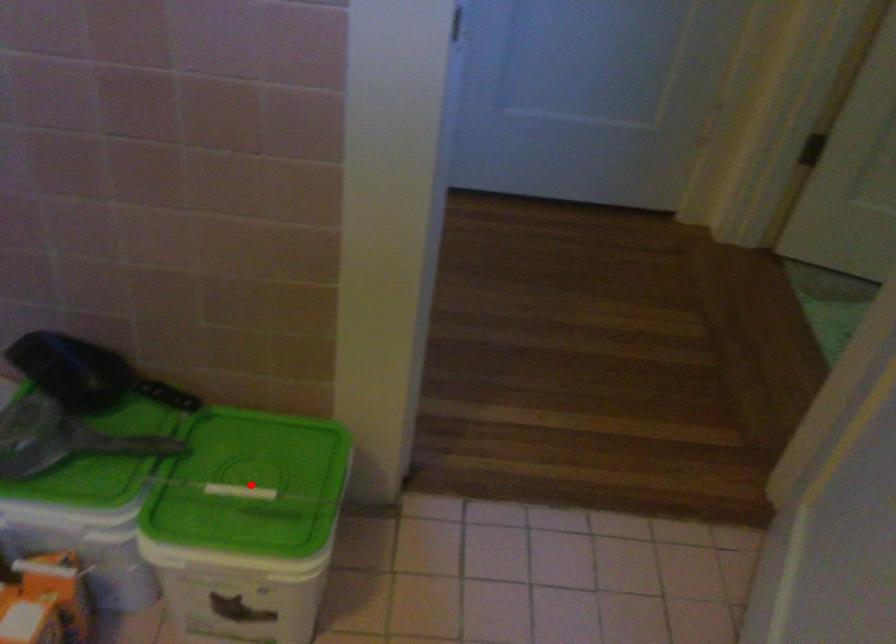
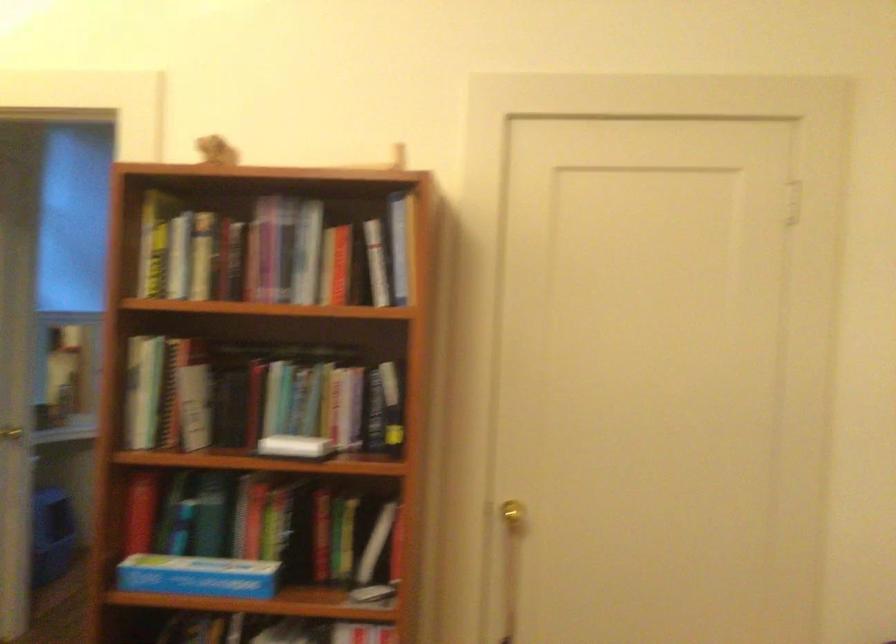
Question: I am providing you with two images of the same scene from different viewpoints. A red point is marked on the first image. Can you still see the location of the red point in image 2?

Choices:
 (A) Yes
 (B) No

Answer: (B)